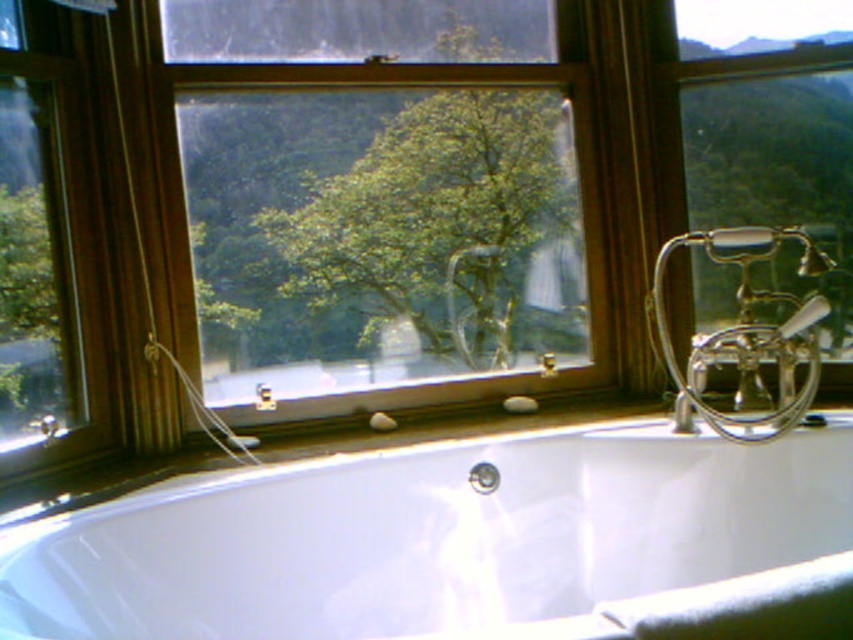
You are a delivery person trying to place a large package that is 1.2 meters long between the white glossy bathtub at center and the window. Is there enough space for the package?

The distance between the white glossy bathtub at center and the window is 1.04 meters, which is shorter than the package length of 1.2 meters. Therefore, there isn not enough space to place the package between them.